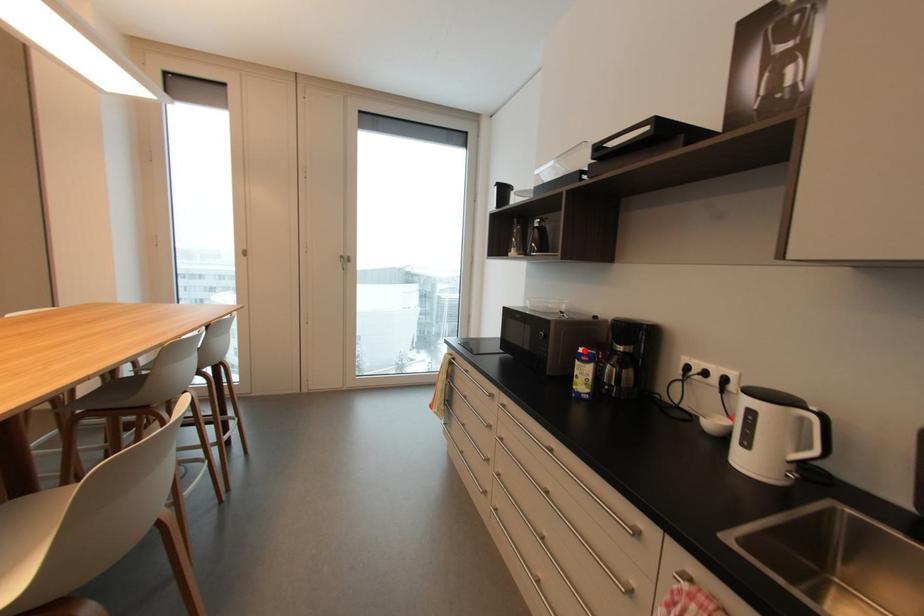
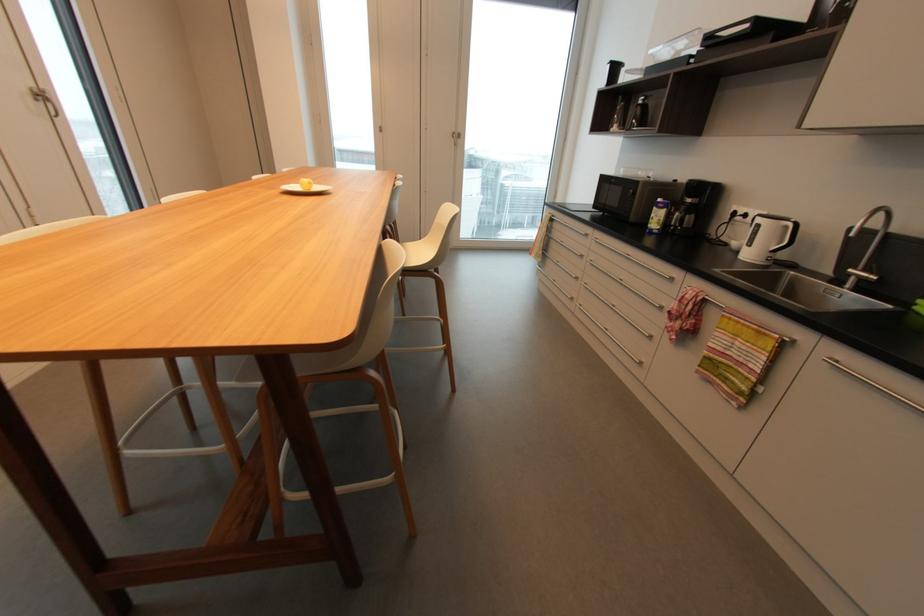
Where in the second image is the point corresponding to the highlighted location from the first image?

(663, 200)